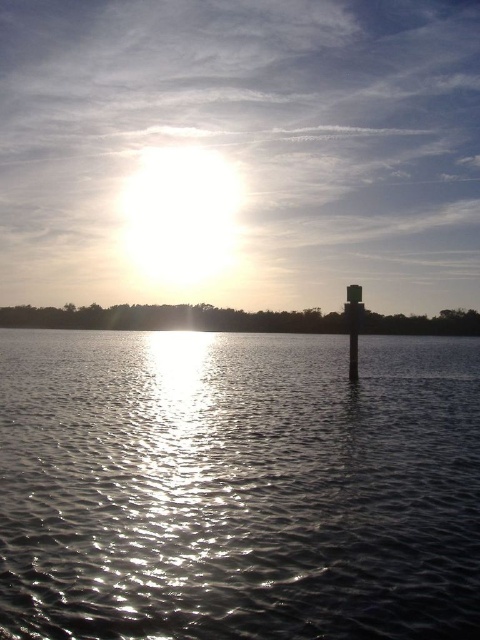
Does glistening silver water at center appear on the right side of smooth concrete pillar at center?

No, glistening silver water at center is not to the right of smooth concrete pillar at center.

Who is positioned more to the left, glistening silver water at center or smooth concrete pillar at center?

Positioned to the left is glistening silver water at center.

Find the location of a particular element. Image resolution: width=480 pixels, height=640 pixels. glistening silver water at center is located at coordinates (238, 486).